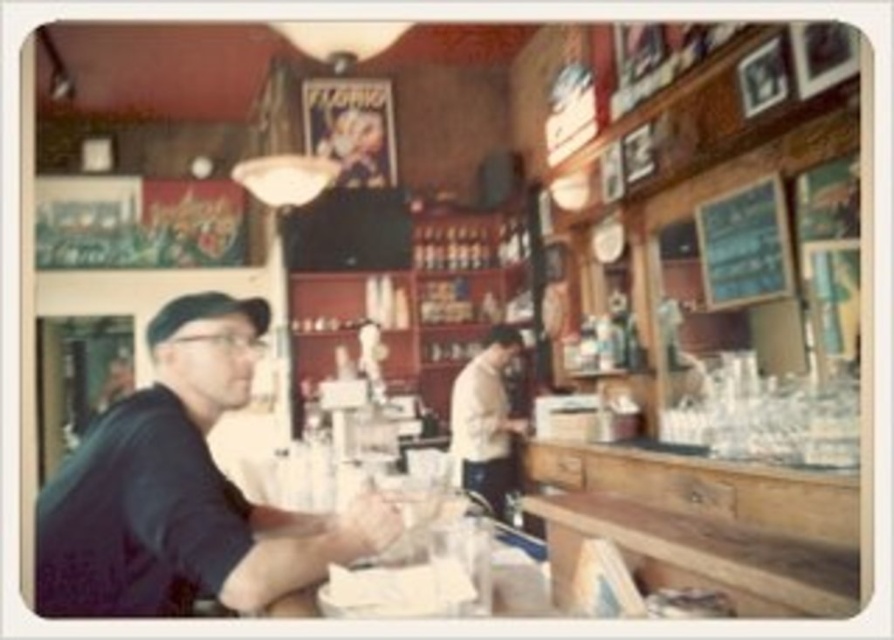
Between point (224, 554) and point (735, 216), which one is positioned in front?

Point (224, 554) is more forward.

Is dark blue shirt at left further to camera compared to green chalkboard at upper right?

No, dark blue shirt at left is closer to the viewer.

Locate an element on the screen. The height and width of the screenshot is (640, 894). dark blue shirt at left is located at coordinates (182, 490).

Can you confirm if dark blue shirt at left is shorter than light beige sweater at center?

Yes.

Is point (204, 468) closer to viewer compared to point (505, 442)?

Yes, it is in front of point (505, 442).

Between point (338, 560) and point (473, 436), which one is positioned behind?

The point (473, 436) is more distant.

This screenshot has width=894, height=640. In order to click on dark blue shirt at left in this screenshot , I will do `click(182, 490)`.

Consider the image. Does green chalkboard at upper right have a smaller size compared to light beige sweater at center?

Indeed, green chalkboard at upper right has a smaller size compared to light beige sweater at center.

Is green chalkboard at upper right to the right of light beige sweater at center from the viewer's perspective?

Yes, green chalkboard at upper right is to the right of light beige sweater at center.

Locate an element on the screen. This screenshot has height=640, width=894. green chalkboard at upper right is located at coordinates (744, 244).